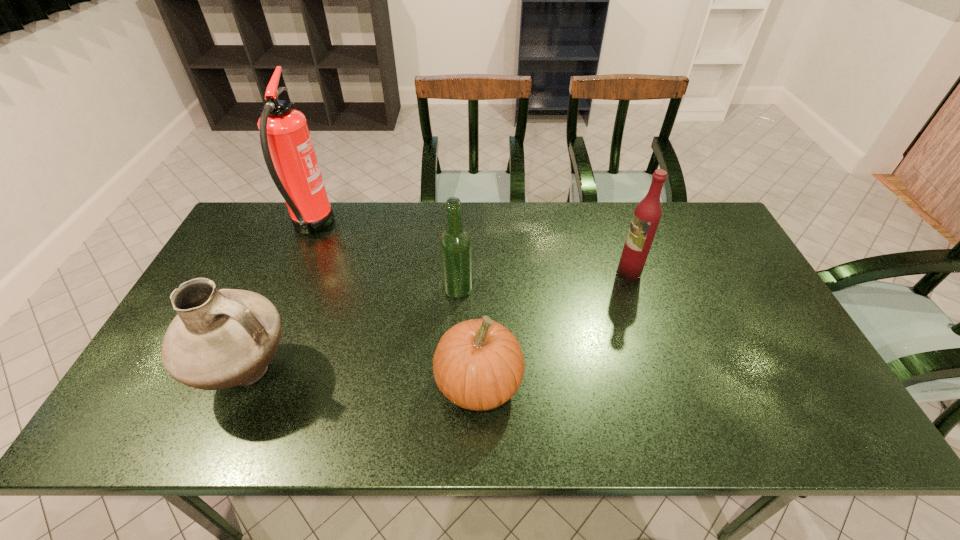
In the image, there is a desktop. Where is `vacant space at the left edge`? The image size is (960, 540). vacant space at the left edge is located at coordinates (222, 265).

Image resolution: width=960 pixels, height=540 pixels. Find the location of `free region at the right edge of the desktop`. free region at the right edge of the desktop is located at coordinates (796, 384).

Identify the location of free space at the near left corner. The image size is (960, 540). (152, 434).

The width and height of the screenshot is (960, 540). What are the coordinates of `vacant space at the far right corner of the desktop` in the screenshot? It's located at (678, 217).

Find the location of a particular element. The width and height of the screenshot is (960, 540). free space that is in between the tallest object and the shortest object is located at coordinates (396, 306).

Where is `empty space between the pitcher and the right liquor`? empty space between the pitcher and the right liquor is located at coordinates (439, 323).

This screenshot has height=540, width=960. Identify the location of empty space that is in between the right liquor and the left liquor. (543, 281).

Identify the location of free spot between the left liquor and the farthest object. The width and height of the screenshot is (960, 540). (384, 259).

Find the location of a particular element. free spot between the pitcher and the rightmost object is located at coordinates (439, 323).

Identify the location of free space between the pumpkin and the fire extinguisher. Image resolution: width=960 pixels, height=540 pixels. (396, 306).